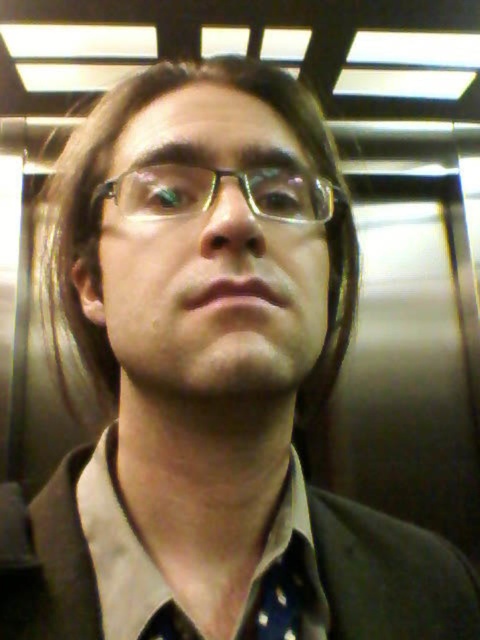
Is blue dotted fabric at center to the left of polka dot fabric tie at center from the viewer's perspective?

No, blue dotted fabric at center is not to the left of polka dot fabric tie at center.

Who is more distant from viewer, (290, 540) or (159, 621)?

The point (290, 540) is behind.

Where is `blue dotted fabric at center`? This screenshot has width=480, height=640. blue dotted fabric at center is located at coordinates (282, 595).

Can you confirm if light brown cotton shirt at center is thinner than polka dot fabric tie at center?

In fact, light brown cotton shirt at center might be wider than polka dot fabric tie at center.

Can you confirm if light brown cotton shirt at center is positioned to the left of polka dot fabric tie at center?

Yes, light brown cotton shirt at center is to the left of polka dot fabric tie at center.

Does point (123, 628) come behind point (186, 628)?

No.

This screenshot has width=480, height=640. Find the location of `light brown cotton shirt at center`. light brown cotton shirt at center is located at coordinates (117, 548).

Between gold-framed glasses at center and blue dotted fabric at center, which one is positioned higher?

gold-framed glasses at center

Which of these two, gold-framed glasses at center or blue dotted fabric at center, stands shorter?

With less height is gold-framed glasses at center.

Who is more distant from viewer, (x=203, y=202) or (x=295, y=604)?

The point (x=295, y=604) is more distant.

Where is `gold-framed glasses at center`? Image resolution: width=480 pixels, height=640 pixels. gold-framed glasses at center is located at coordinates (217, 189).